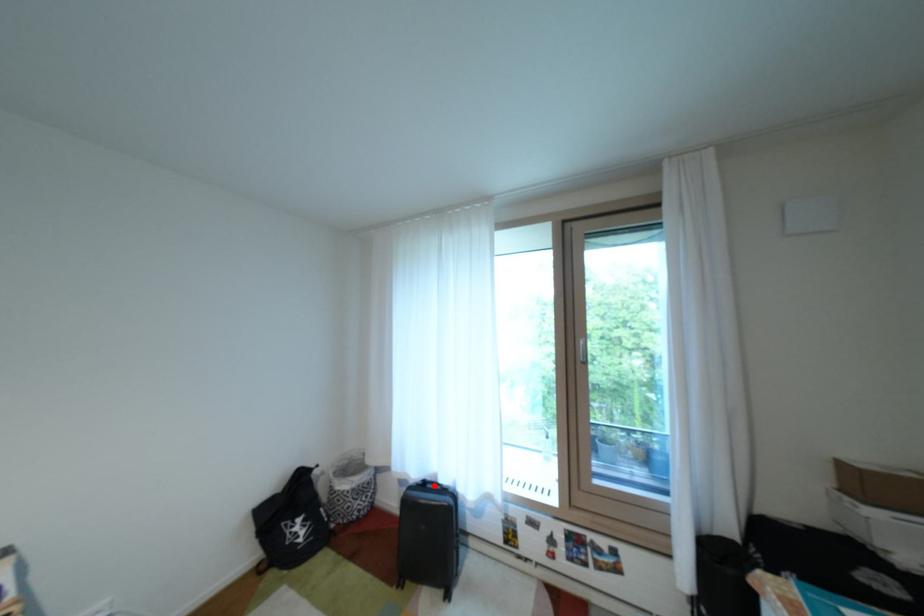
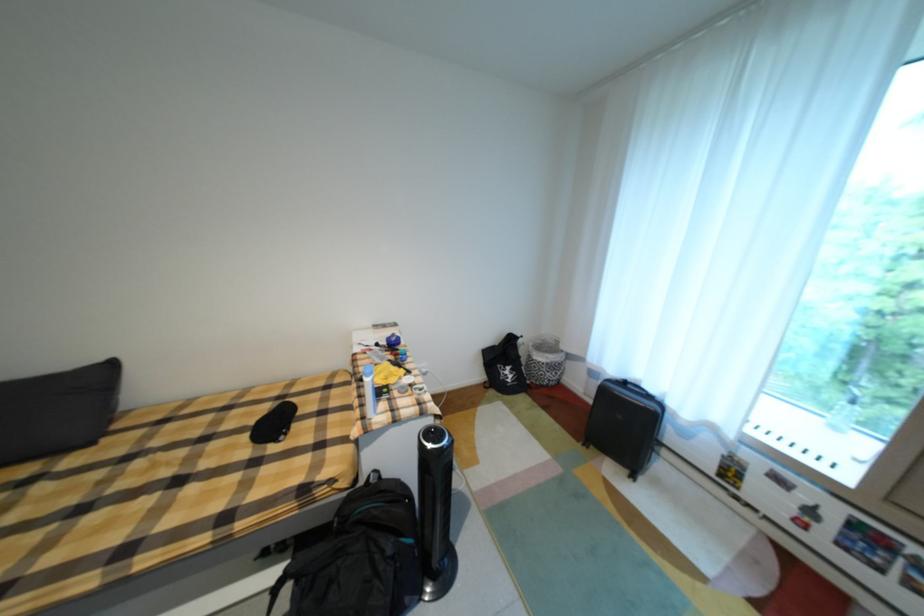
Question: I am providing you with two images of the same scene from different viewpoints. In image1, a red point is highlighted. Considering the same 3D point in image2, which of the following is correct?

Choices:
 (A) It is closer
 (B) It is farther

Answer: (A)